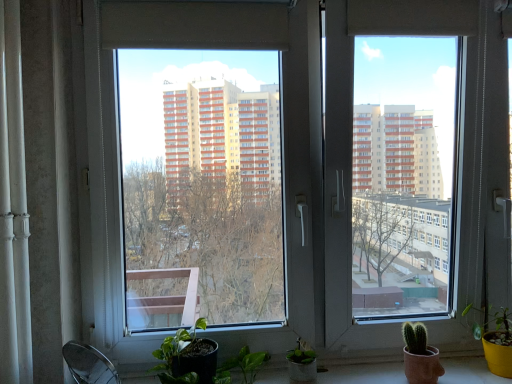
What do you see at coordinates (207, 173) in the screenshot?
I see `transparent glass window at center` at bounding box center [207, 173].

What do you see at coordinates (13, 208) in the screenshot?
I see `white glossy curtain at left` at bounding box center [13, 208].

Locate an element on the screen. The height and width of the screenshot is (384, 512). transparent glass window at center is located at coordinates (207, 173).

Considering the relative sizes of transparent glass window at center and white glossy window sill at lower center in the image provided, is transparent glass window at center smaller than white glossy window sill at lower center?

No, transparent glass window at center is not smaller than white glossy window sill at lower center.

Who is taller, transparent glass window at center or white glossy window sill at lower center?

transparent glass window at center is taller.

Could white glossy window sill at lower center be considered to be inside transparent glass window at center?

Yes, white glossy window sill at lower center is a part of transparent glass window at center.

From a real-world perspective, which object stands above the other?

transparent glass window at center.

Based on the photo, from the image's perspective, is transparent glass window at center positioned above or below white glossy curtain at left?

From the image's perspective, transparent glass window at center appears above white glossy curtain at left.

Between transparent glass window at center and white glossy curtain at left, which one has smaller size?

white glossy curtain at left.

Is transparent glass window at center with white glossy curtain at left?

No, transparent glass window at center is not with white glossy curtain at left.

Does white glossy window sill at lower center have a lesser height compared to transparent glass window at center?

Correct, white glossy window sill at lower center is not as tall as transparent glass window at center.

The width and height of the screenshot is (512, 384). In the image, there is a white glossy window sill at lower center. Find the location of `window above it (from the image's perspective)`. window above it (from the image's perspective) is located at coordinates (207, 173).

Between white glossy window sill at lower center and transparent glass window at center, which one has smaller width?

Thinner between the two is transparent glass window at center.

Is transparent glass window at center outside of matte yellow pot at lower right?

Yes, transparent glass window at center is outside of matte yellow pot at lower right.

Are transparent glass window at center and matte yellow pot at lower right located far from each other?

They are positioned close to each other.

From a real-world perspective, which is physically below, transparent glass window at center or matte yellow pot at lower right?

In real-world perspective, matte yellow pot at lower right is lower.

Could you tell me if transparent glass window at center is turned towards matte yellow pot at lower right?

Yes, transparent glass window at center is facing matte yellow pot at lower right.

Is there a large distance between white glossy window sill at lower center and white glossy curtain at left?

white glossy window sill at lower center is near white glossy curtain at left, not far away.

Is white glossy window sill at lower center at the right side of white glossy curtain at left?

Indeed, white glossy window sill at lower center is positioned on the right side of white glossy curtain at left.

Which object is thinner, white glossy window sill at lower center or white glossy curtain at left?

white glossy curtain at left.

What's the angular difference between white glossy window sill at lower center and matte yellow pot at lower right's facing directions?

1.69 degrees.

I want to click on houseplant behind the white glossy window sill at lower center, so click(497, 343).

Which object is positioned more to the right, white glossy window sill at lower center or matte yellow pot at lower right?

From the viewer's perspective, matte yellow pot at lower right appears more on the right side.

Is white glossy window sill at lower center bigger than matte yellow pot at lower right?

Indeed, white glossy window sill at lower center has a larger size compared to matte yellow pot at lower right.

Considering the positions of points (17, 17) and (473, 364), is point (17, 17) farther from camera compared to point (473, 364)?

That is False.

From the image's perspective, which is above, white glossy curtain at left or white glossy window sill at lower center?

white glossy curtain at left appears higher in the image.

In the scene shown: Is white glossy window sill at lower center at the back of white glossy curtain at left?

white glossy curtain at left is not turned away from white glossy window sill at lower center.

Is white glossy curtain at left thinner than white glossy window sill at lower center?

Yes.

This screenshot has width=512, height=384. What are the coordinates of `window behind the white glossy window sill at lower center` in the screenshot? It's located at (207, 173).

You are a GUI agent. You are given a task and a screenshot of the screen. Output one action in this format:
    pyautogui.click(x=<x>, y=<y>)
    Task: Click on the curtain that is under the transparent glass window at center (from a real-world perspective)
    This screenshot has width=512, height=384.
    Given the screenshot: What is the action you would take?
    pyautogui.click(x=13, y=208)

Which object lies further to the anchor point matte yellow pot at lower right, white glossy curtain at left or white glossy window sill at lower center?

Among the two, white glossy curtain at left is located further to matte yellow pot at lower right.

Which object lies nearer to the anchor point white glossy window sill at lower center, white glossy curtain at left or matte yellow pot at lower right?

The object closer to white glossy window sill at lower center is matte yellow pot at lower right.

Consider the image. Considering their positions, is white glossy window sill at lower center positioned further to matte yellow pot at lower right than white glossy curtain at left?

white glossy curtain at left is further to matte yellow pot at lower right.

Which object lies further to the anchor point transparent glass window at center, matte yellow pot at lower right or white glossy window sill at lower center?

matte yellow pot at lower right lies further to transparent glass window at center than the other object.

Estimate the real-world distances between objects in this image. Which object is further from matte yellow pot at lower right, transparent glass window at center or white glossy window sill at lower center?

Based on the image, transparent glass window at center appears to be further to matte yellow pot at lower right.

Estimate the real-world distances between objects in this image. Which object is further from white glossy curtain at left, transparent glass window at center or white glossy window sill at lower center?

Based on the image, white glossy window sill at lower center appears to be further to white glossy curtain at left.

From the image, which object appears to be nearer to transparent glass window at center, white glossy window sill at lower center or matte yellow pot at lower right?

The object closer to transparent glass window at center is white glossy window sill at lower center.

From the image, which object appears to be nearer to transparent glass window at center, white glossy curtain at left or white glossy window sill at lower center?

Based on the image, white glossy curtain at left appears to be nearer to transparent glass window at center.

What are the coordinates of `window located between white glossy curtain at left and matte yellow pot at lower right in the left-right direction` in the screenshot? It's located at (207, 173).

This screenshot has height=384, width=512. What are the coordinates of `window located between white glossy window sill at lower center and matte yellow pot at lower right in the left-right direction` in the screenshot? It's located at (207, 173).

In order to click on window sill between white glossy curtain at left and matte yellow pot at lower right in this screenshot , I will do `click(364, 371)`.

You are a GUI agent. You are given a task and a screenshot of the screen. Output one action in this format:
    pyautogui.click(x=<x>, y=<y>)
    Task: Click on the window sill between white glossy curtain at left and transparent glass window at center in the horizontal direction
    
    Given the screenshot: What is the action you would take?
    pyautogui.click(x=364, y=371)